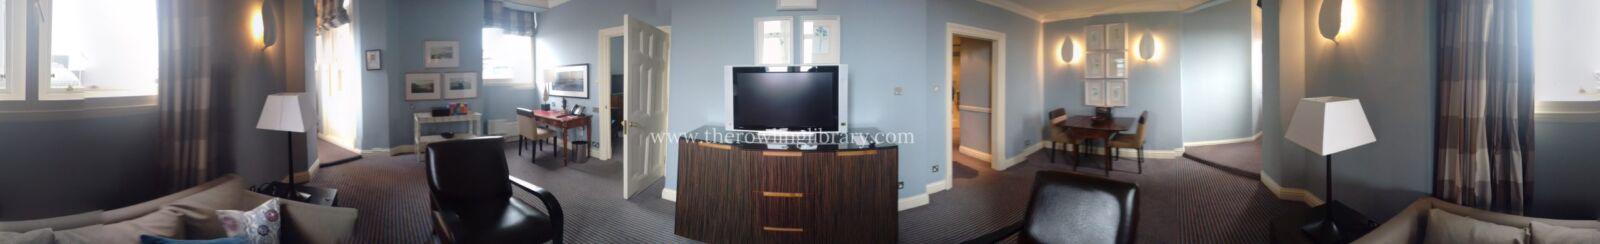
The width and height of the screenshot is (1600, 244). In order to click on brown leather chairs in this screenshot , I will do `click(1040, 230)`, `click(470, 199)`.